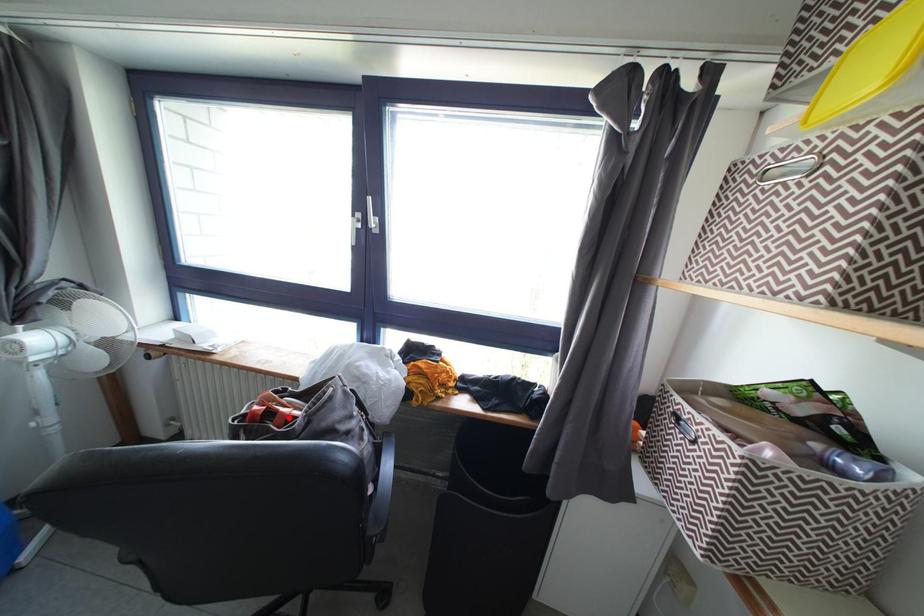
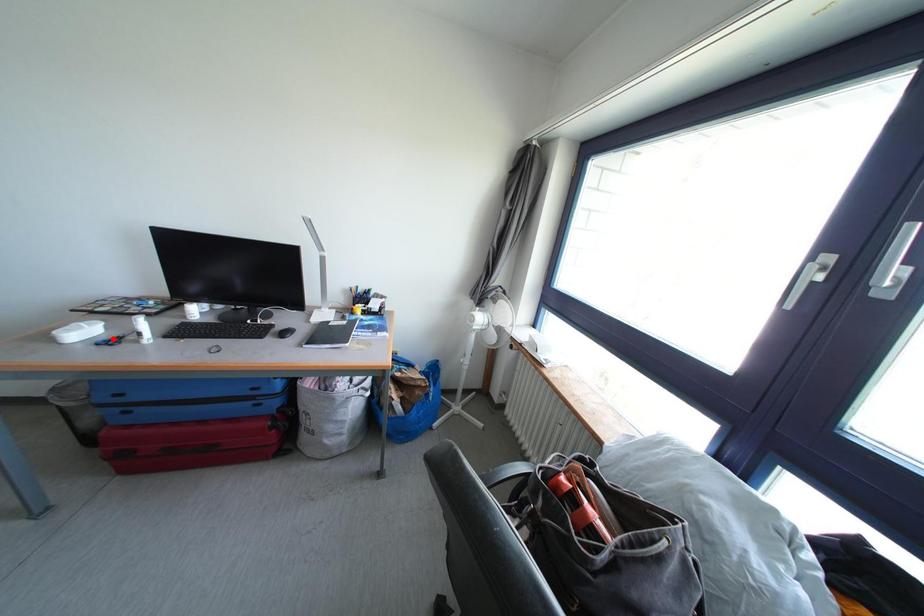
I am providing you with two images of the same scene from different viewpoints. A red point is marked on the first image and another point is marked on the second image. Does the point marked in image1 correspond to the same location as the one in image2?

No